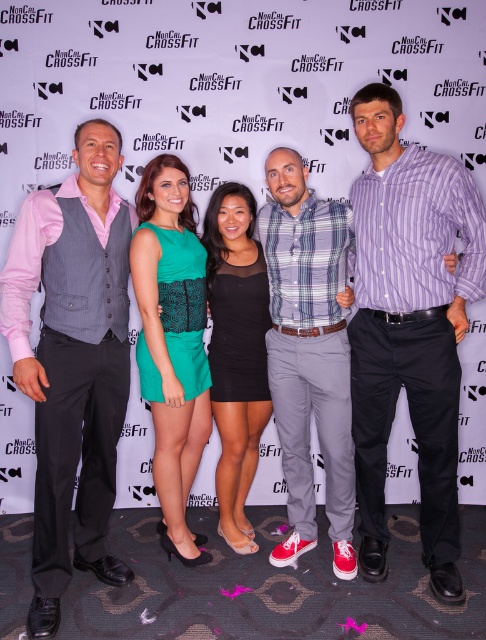
Question: Which object is the farthest from the plaid cotton shirt at center?

Choices:
 (A) purple striped shirt at center
 (B) green textured dress at center
 (C) matte gray vest at left

Answer: (C)

Question: Is plaid cotton shirt at center bigger than green textured dress at center?

Choices:
 (A) yes
 (B) no

Answer: (A)

Question: In this image, where is matte gray vest at left located relative to plaid cotton shirt at center?

Choices:
 (A) left
 (B) right

Answer: (A)

Question: Can you confirm if purple striped shirt at center is positioned to the left of plaid cotton shirt at center?

Choices:
 (A) yes
 (B) no

Answer: (B)

Question: Among these points, which one is farthest from the camera?

Choices:
 (A) (299, 513)
 (B) (151, 324)
 (C) (220, 474)

Answer: (C)

Question: Among these objects, which one is nearest to the camera?

Choices:
 (A) plaid cotton shirt at center
 (B) matte gray vest at left

Answer: (B)